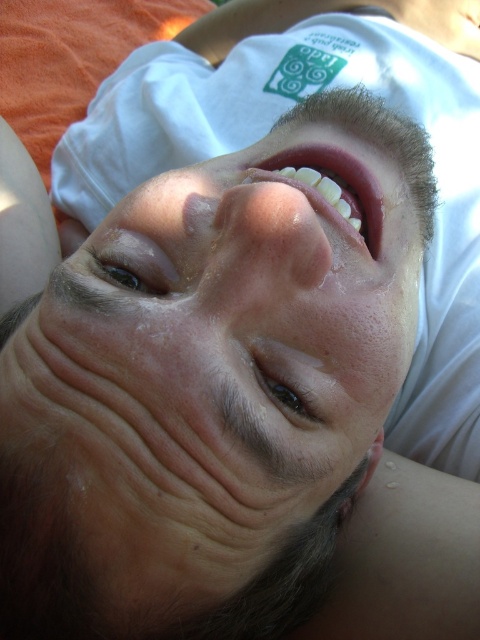
Which is in front, point (146, 214) or point (295, 380)?

Point (295, 380) is in front.

Does point (108, 556) lie behind point (273, 371)?

No, it is in front of (273, 371).

Locate an element on the screen. Image resolution: width=480 pixels, height=640 pixels. dry skin at center is located at coordinates (210, 387).

Is dry skin at center thinner than brown shiny eye at upper center?

Incorrect, dry skin at center's width is not less than brown shiny eye at upper center's.

Who is more distant from viewer, (95, 333) or (126, 257)?

The point (126, 257) is behind.

Who is more distant from viewer, [190,513] or [153,282]?

Point [153,282]

The height and width of the screenshot is (640, 480). Find the location of `dry skin at center`. dry skin at center is located at coordinates (210, 387).

Which is behind, point (338, 148) or point (131, 269)?

Positioned behind is point (338, 148).

Is point (347, 157) positioned in front of point (118, 280)?

No, (347, 157) is behind (118, 280).

Does point (338, 161) come in front of point (148, 272)?

No, (338, 161) is further to viewer.

Where is `pink glossy lips at center`? pink glossy lips at center is located at coordinates (338, 180).